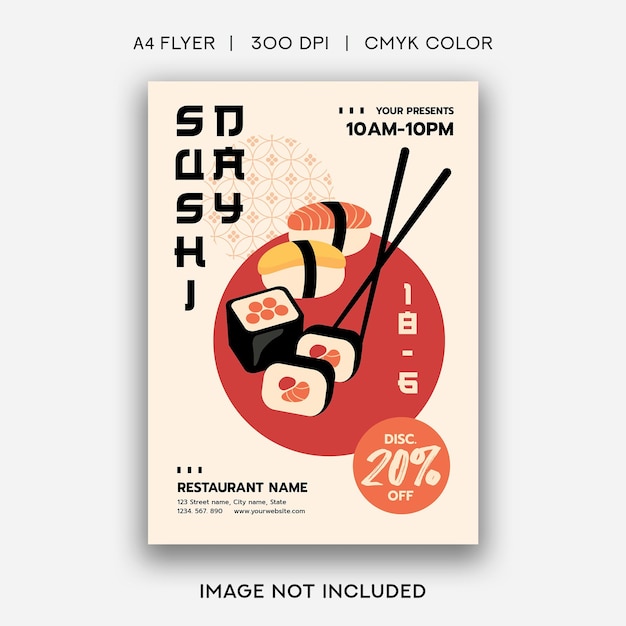
Locate an element on the screen. The image size is (626, 626). chopsticks image is located at coordinates (377, 255).